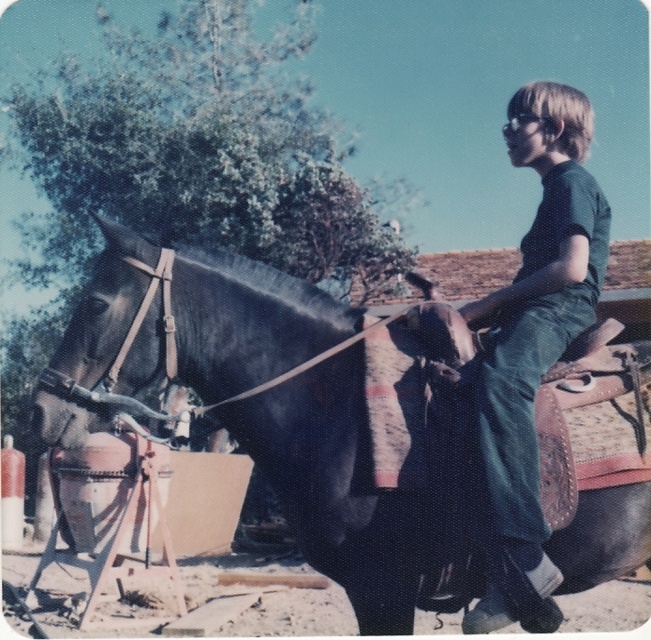
You are standing at the origin point of the coordinate system in the image. There is a shiny black horse at center located at point (380, 468). What is the direction of the shiny black horse at center relative to your current position?

The shiny black horse at center is located at point (380, 468), which is to the right and slightly above your current position at the origin.

You are a photographer aiming to capture the shiny black horse at center and the green denim pants at center in a single shot. Based on their positions, which object should you focus on first to ensure both are in frame?

The shiny black horse at center is located below the green denim pants at center, so you should focus on the green denim pants at center first to ensure both are in frame.